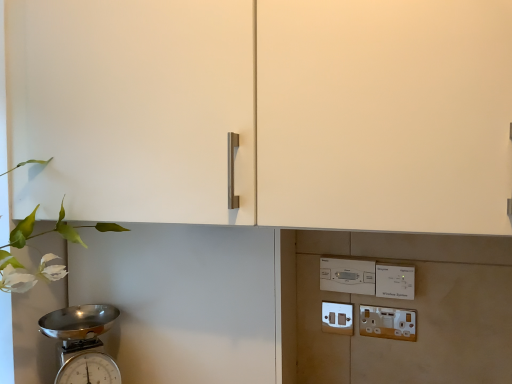
Question: Is white plastic light switch at lower right, arranged as the 2th light switch when viewed from the left, not near white plastic light switch at center, which is the second light switch in right-to-left order?

Choices:
 (A) no
 (B) yes

Answer: (A)

Question: Considering the relative positions of white plastic light switch at lower right, arranged as the 2th light switch when viewed from the left, and white plastic light switch at center, which is counted as the first light switch, starting from the left, in the image provided, is white plastic light switch at lower right, arranged as the 2th light switch when viewed from the left, to the right of white plastic light switch at center, which is counted as the first light switch, starting from the left, from the viewer's perspective?

Choices:
 (A) no
 (B) yes

Answer: (B)

Question: From a real-world perspective, does white plastic light switch at lower right, arranged as the 2th light switch when viewed from the left, stand above white plastic light switch at center, which is the second light switch in right-to-left order?

Choices:
 (A) no
 (B) yes

Answer: (A)

Question: Considering the relative sizes of white plastic light switch at lower right, the first light switch positioned from the right, and white plastic light switch at center, which is counted as the first light switch, starting from the left, in the image provided, is white plastic light switch at lower right, the first light switch positioned from the right, taller than white plastic light switch at center, which is counted as the first light switch, starting from the left,?

Choices:
 (A) yes
 (B) no

Answer: (A)

Question: From the image's perspective, would you say white plastic light switch at lower right, the first light switch positioned from the right, is shown under white plastic light switch at center, which is the second light switch in right-to-left order?

Choices:
 (A) yes
 (B) no

Answer: (A)

Question: From a real-world perspective, is matte white switch at lower center, the first electric outlet in the back-to-front sequence, physically located above or below white plastic light switch at center, which is the second light switch in right-to-left order?

Choices:
 (A) above
 (B) below

Answer: (B)

Question: From the image's perspective, is matte white switch at lower center, the first electric outlet in the back-to-front sequence, positioned above or below white plastic light switch at center, which is the second light switch in right-to-left order?

Choices:
 (A) above
 (B) below

Answer: (B)

Question: Would you say matte white switch at lower center, which is the 1th electric outlet from left to right, is to the left or to the right of white plastic light switch at center, which is counted as the first light switch, starting from the left, in the picture?

Choices:
 (A) left
 (B) right

Answer: (A)

Question: Relative to white plastic light switch at center, which is counted as the first light switch, starting from the left, is matte white switch at lower center, the first electric outlet in the back-to-front sequence, in front or behind?

Choices:
 (A) behind
 (B) front

Answer: (A)

Question: Considering the positions of white plastic light switch at lower right, arranged as the 2th light switch when viewed from the left, and white plastic electric outlet at lower right, marked as the 1th electric outlet in a right-to-left arrangement, in the image, is white plastic light switch at lower right, arranged as the 2th light switch when viewed from the left, wider or thinner than white plastic electric outlet at lower right, marked as the 1th electric outlet in a right-to-left arrangement,?

Choices:
 (A) thin
 (B) wide

Answer: (B)

Question: In the image, is white plastic light switch at lower right, arranged as the 2th light switch when viewed from the left, on the left side or the right side of white plastic electric outlet at lower right, which is the second electric outlet in left-to-right order?

Choices:
 (A) left
 (B) right

Answer: (B)

Question: Based on their sizes in the image, would you say white plastic light switch at lower right, the first light switch positioned from the right, is bigger or smaller than white plastic electric outlet at lower right, positioned as the 1th electric outlet in front-to-back order?

Choices:
 (A) small
 (B) big

Answer: (B)

Question: Is white plastic light switch at lower right, arranged as the 2th light switch when viewed from the left, in front of or behind white plastic electric outlet at lower right, arranged as the 2th electric outlet when viewed from the back, in the image?

Choices:
 (A) front
 (B) behind

Answer: (A)

Question: Relative to white plastic electric outlet at lower right, which is the second electric outlet in left-to-right order, is matte white switch at lower center, which is the 1th electric outlet from left to right, in front or behind?

Choices:
 (A) front
 (B) behind

Answer: (B)

Question: Which is correct: matte white switch at lower center, which is the 1th electric outlet from left to right, is inside white plastic electric outlet at lower right, arranged as the 2th electric outlet when viewed from the back, or outside of it?

Choices:
 (A) outside
 (B) inside

Answer: (A)